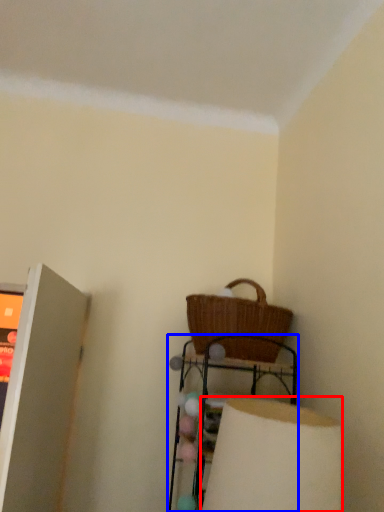
Question: Which object appears farthest to the camera in this image, lamp (highlighted by a red box) or furniture (highlighted by a blue box)?

Choices:
 (A) lamp
 (B) furniture

Answer: (B)